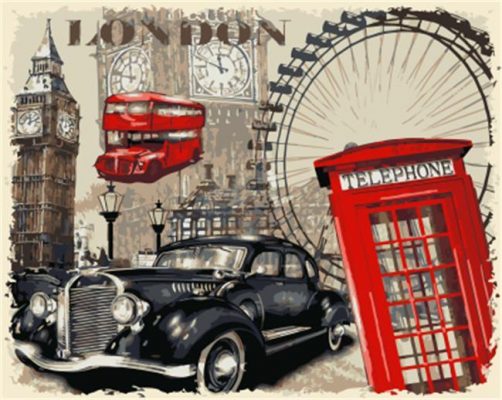
Image resolution: width=502 pixels, height=400 pixels. Identify the location of door. (268, 288).